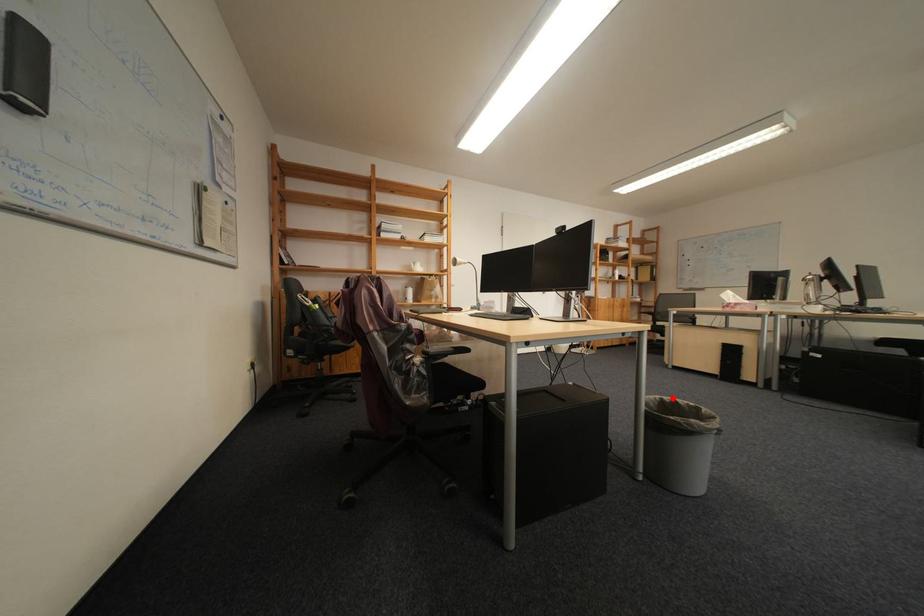
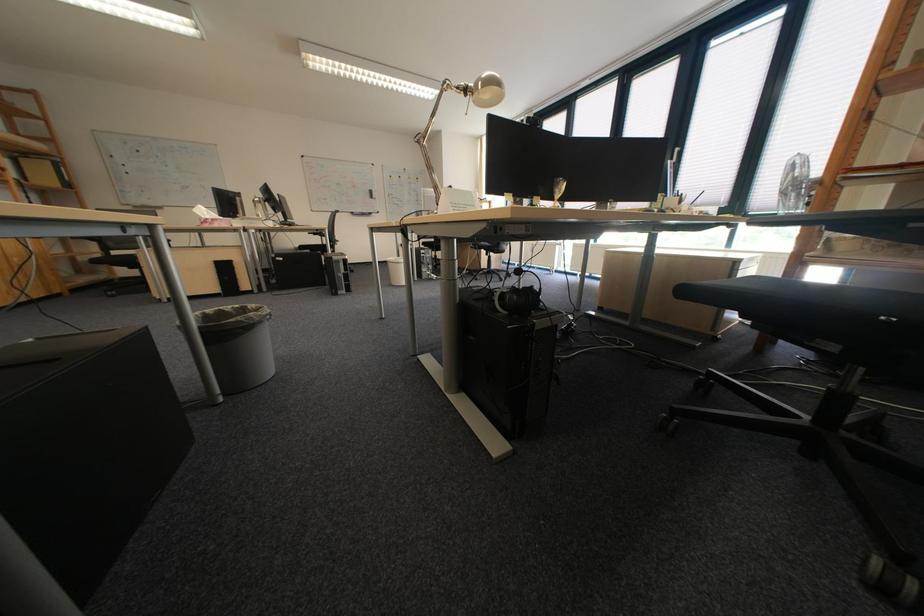
Find the pixel in the second image that matches the highlighted location in the first image.

(213, 314)